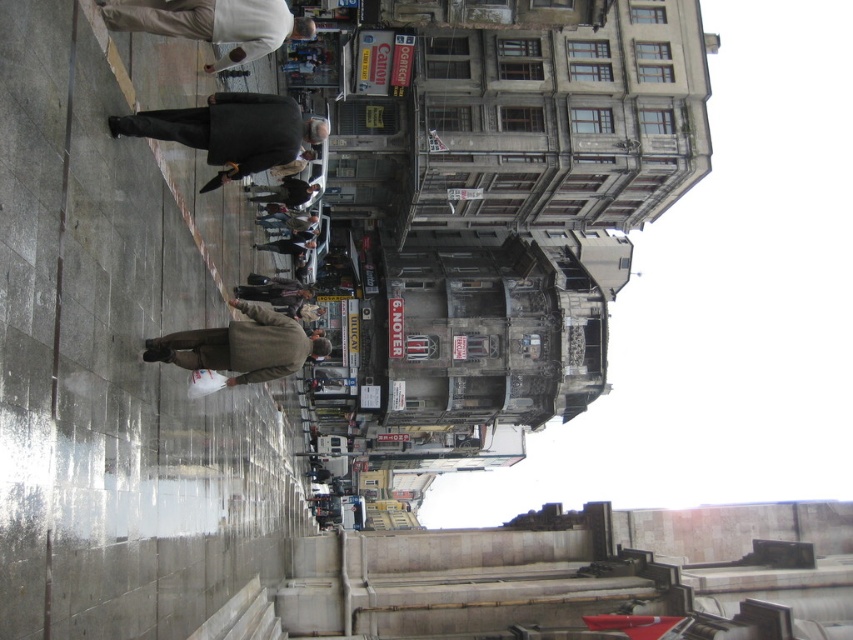
Which is more to the right, dark wool coat at center or white matte jacket at upper center?

dark wool coat at center

Does dark wool coat at center lie behind white matte jacket at upper center?

Yes, it is.

Is point (235, 173) in front of point (136, 13)?

No.

Where is `dark wool coat at center`? This screenshot has height=640, width=853. dark wool coat at center is located at coordinates (229, 131).

Which is below, dark wool coat at center or brown woolen coat at lower center?

brown woolen coat at lower center

Can you confirm if dark wool coat at center is positioned below brown woolen coat at lower center?

No.

Which is in front, point (233, 154) or point (283, 364)?

Positioned in front is point (233, 154).

I want to click on dark wool coat at center, so click(229, 131).

The height and width of the screenshot is (640, 853). What do you see at coordinates (212, 22) in the screenshot? I see `white matte jacket at upper center` at bounding box center [212, 22].

Between white matte jacket at upper center and brown woolen coat at lower center, which one has more height?

white matte jacket at upper center

The width and height of the screenshot is (853, 640). I want to click on white matte jacket at upper center, so click(212, 22).